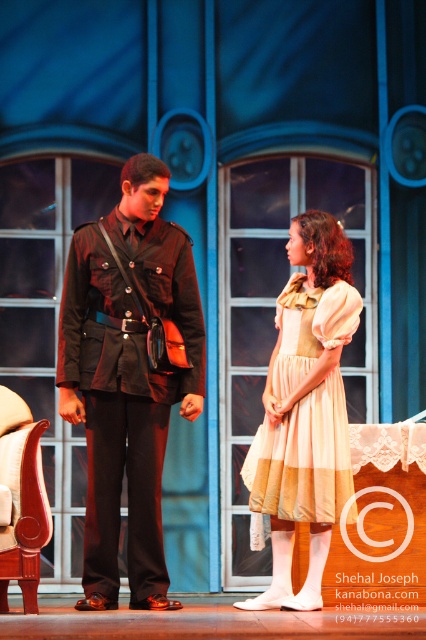
In the theatrical scene, there are two characters wearing a matte black uniform at center and a striped cotton dress at center. Which character is positioned to the left of the other?

The matte black uniform at center is to the left of striped cotton dress at center.

You are a stagehand measuring the distance between the two characters for a scene change. The minimum required space between them for safe passage is 20 inches. Is the current distance between the matte black uniform at center and the striped cotton dress at center sufficient?

The matte black uniform at center and striped cotton dress at center are 21.78 inches apart from each other, which exceeds the minimum required 20 inches, so the current distance is sufficient for safe passage.